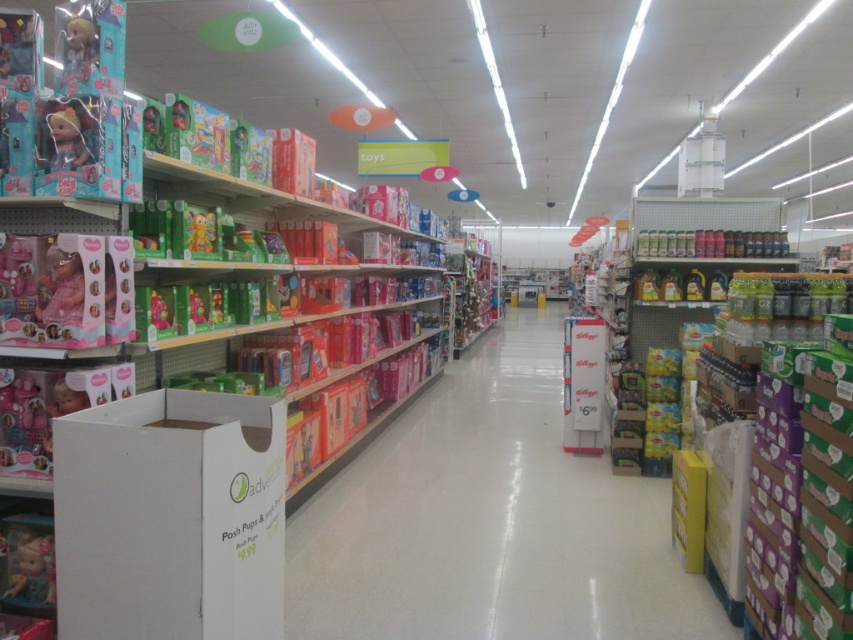
Is point (473, 573) positioned before point (53, 172)?

That is False.

You are a GUI agent. You are given a task and a screenshot of the screen. Output one action in this format:
    pyautogui.click(x=<x>, y=<y>)
    Task: Click on the matte cardboard boxes at center
    
    Given the screenshot: What is the action you would take?
    pyautogui.click(x=491, y=522)

Is matte cardboard boxes at center wider than matte pink doll at left?

Indeed, matte cardboard boxes at center has a greater width compared to matte pink doll at left.

Who is taller, matte cardboard boxes at center or matte pink doll at left?

Standing taller between the two is matte pink doll at left.

Is point (428, 525) positioned in front of point (80, 282)?

No, it is behind (80, 282).

The height and width of the screenshot is (640, 853). I want to click on matte cardboard boxes at center, so click(491, 522).

The height and width of the screenshot is (640, 853). What do you see at coordinates (67, 140) in the screenshot?
I see `matte plastic doll at left` at bounding box center [67, 140].

Is point (51, 147) more distant than point (149, 122)?

No, (51, 147) is in front of (149, 122).

Which is behind, point (38, 122) or point (149, 122)?

The point (149, 122) is behind.

Locate an element on the screen. matte plastic doll at left is located at coordinates (67, 140).